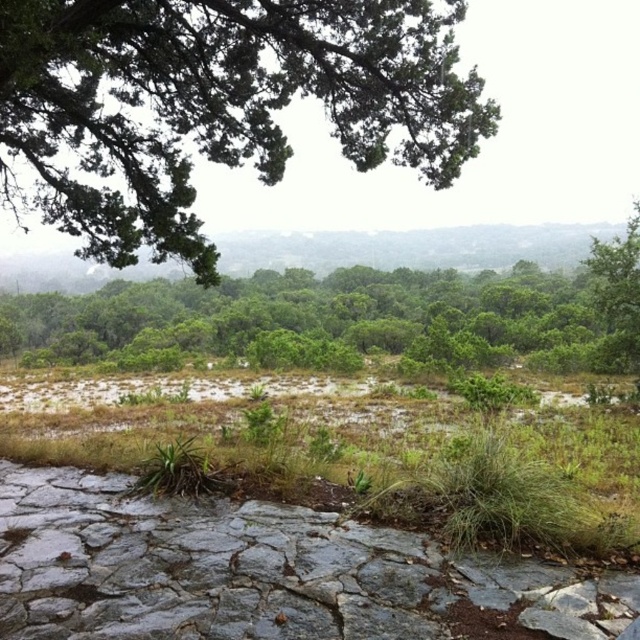
You are a hiker trying to navigate through the rocky terrain in the image. You need to step on the green grass at lower center and the green leafy tree at center to avoid getting muddy. Which one should you step on first based on their sizes?

The green grass at lower center is smaller than the green leafy tree at center, so you should step on the green grass at lower center first since it is smaller and closer to the ground.

Based on the photo, you are a hiker trying to navigate through the forest depicted in the image. You need to determine which tree to climb for a better view. Which tree between the green textured tree at upper left and the green leafy tree at center would provide a higher vantage point?

The green leafy tree at center is taller than the green textured tree at upper left, so climbing the green leafy tree at center would provide a higher vantage point.